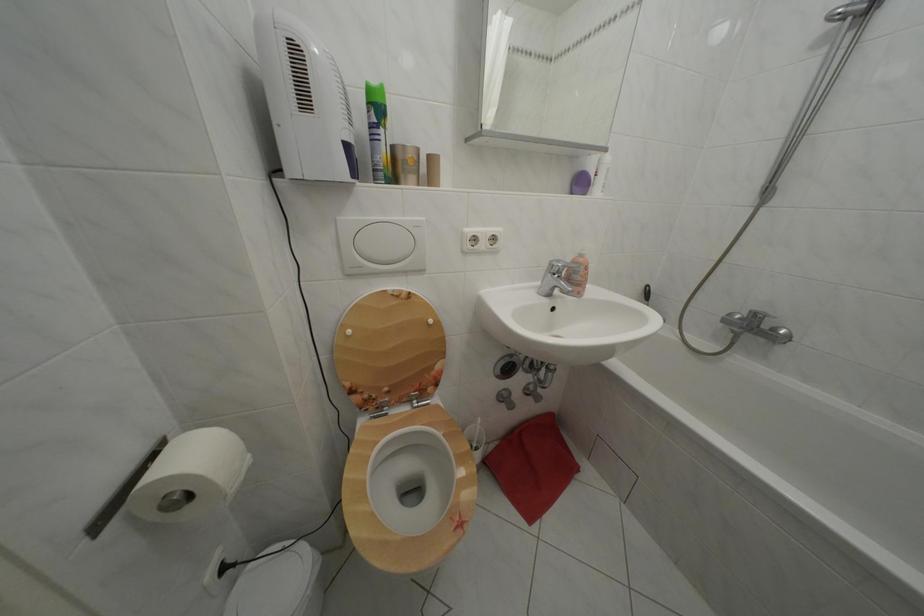
I want to click on wooden toilet seat, so click(407, 488).